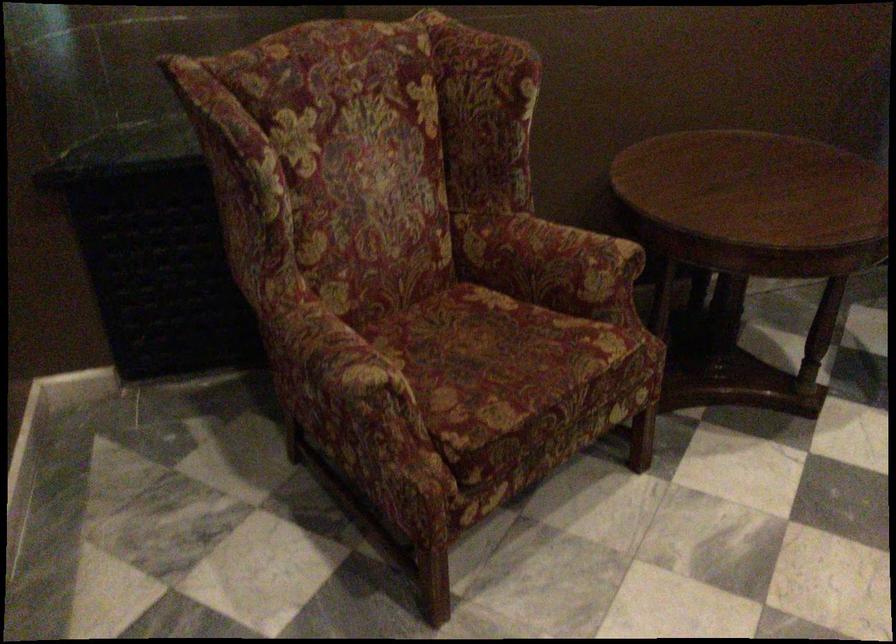
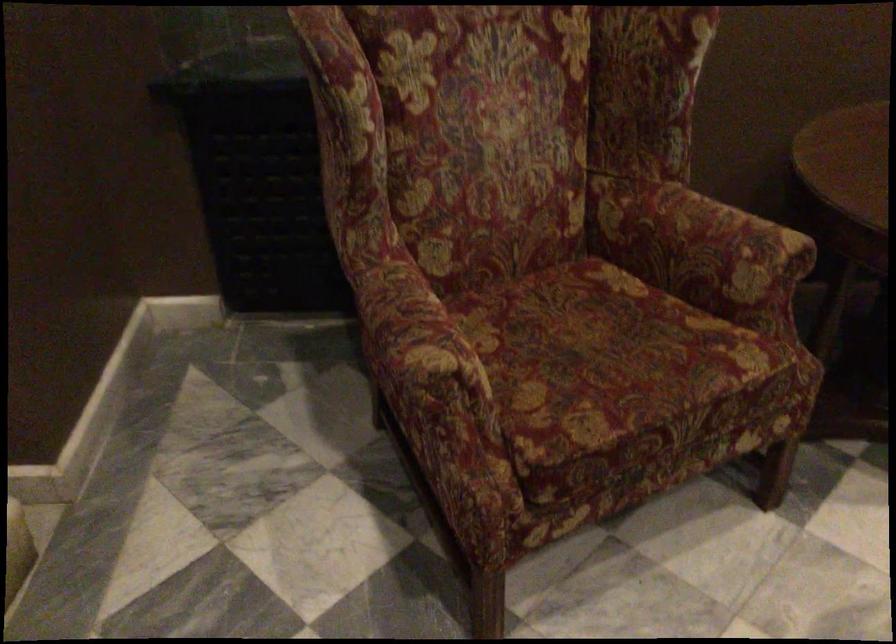
Question: The camera is either moving clockwise (left) or counter-clockwise (right) around the object. The first image is from the beginning of the video and the second image is from the end. Is the camera moving left or right when shooting the video?

Choices:
 (A) Left
 (B) Right

Answer: (B)